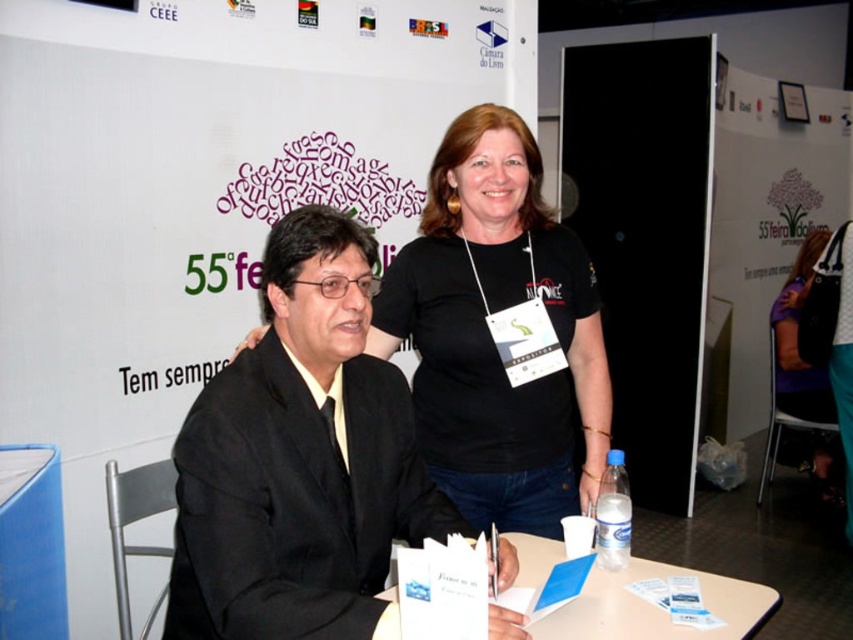
Which is more to the left, black cotton t-shirt at upper center or white plastic table at center?

black cotton t-shirt at upper center is more to the left.

Does point (526, 378) come farther from viewer compared to point (761, 602)?

Yes, it is.

Which is behind, point (540, 492) or point (627, 624)?

The point (540, 492) is behind.

You are a GUI agent. You are given a task and a screenshot of the screen. Output one action in this format:
    pyautogui.click(x=<x>, y=<y>)
    Task: Click on the black cotton t-shirt at upper center
    The height and width of the screenshot is (640, 853).
    Given the screenshot: What is the action you would take?
    pyautogui.click(x=498, y=333)

Can you confirm if black suit at left is shorter than white plastic table at center?

Incorrect, black suit at left's height does not fall short of white plastic table at center's.

Is black suit at left below white plastic table at center?

Incorrect, black suit at left is not positioned below white plastic table at center.

Find the location of a particular element. black suit at left is located at coordinates (300, 460).

Between black cotton t-shirt at upper center and clear plastic bottle at table right, which one is positioned higher?

black cotton t-shirt at upper center

Which of these two, black cotton t-shirt at upper center or clear plastic bottle at table right, stands taller?

black cotton t-shirt at upper center

Where is `black cotton t-shirt at upper center`? The image size is (853, 640). black cotton t-shirt at upper center is located at coordinates (498, 333).